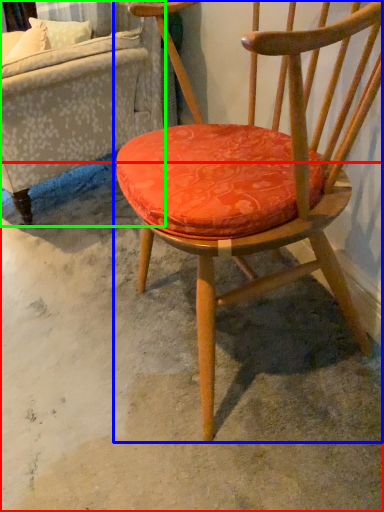
Question: Which object is positioned closest to concrete (highlighted by a red box)? Select from chair (highlighted by a blue box) and studio couch (highlighted by a green box).

Choices:
 (A) chair
 (B) studio couch

Answer: (A)